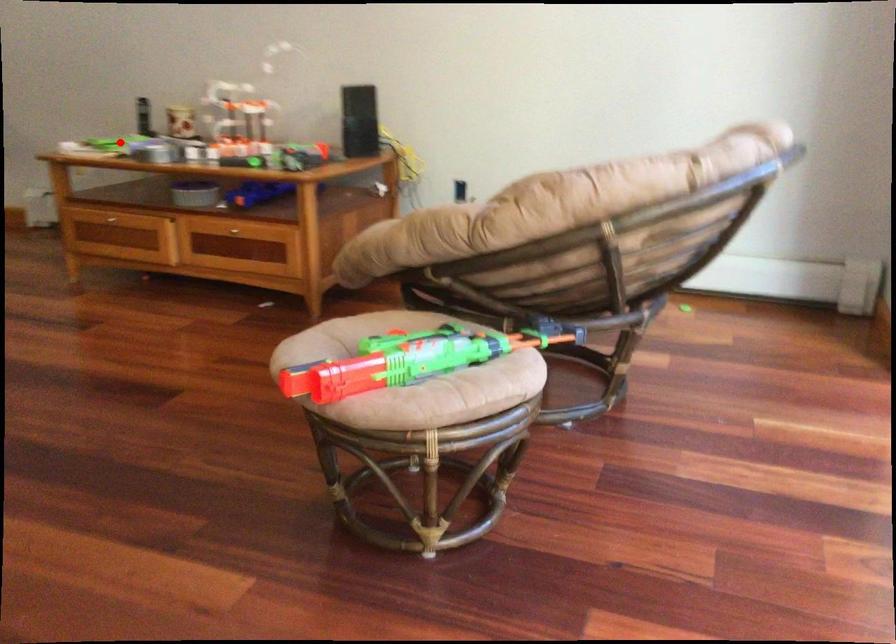
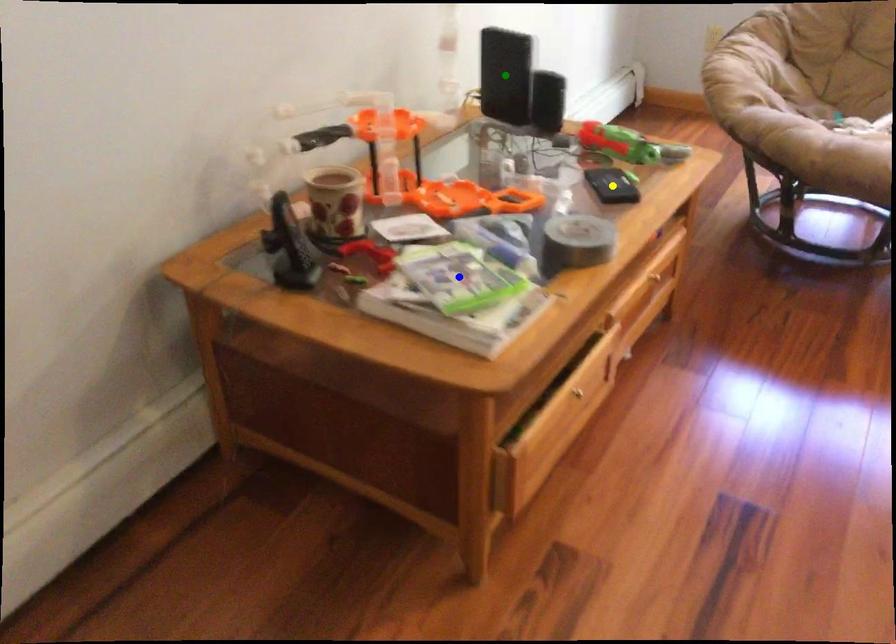
Question: I am providing you with two images of the same scene from different viewpoints. A red point is marked on the first image. You are given multiple points on the second image. Which spot in image 2 lines up with the point in image 1?

Choices:
 (A) blue point
 (B) green point
 (C) yellow point

Answer: (A)